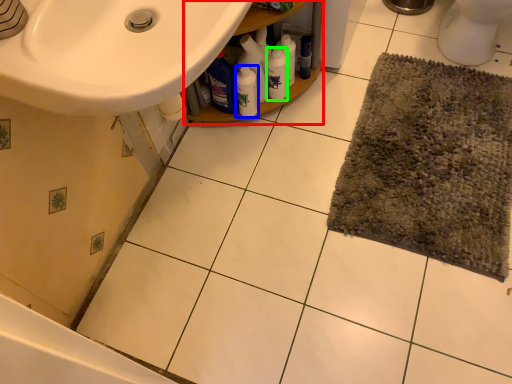
Question: Which is nearer to the balustrade (highlighted by a red box)? bottle (highlighted by a blue box) or cleaning product (highlighted by a green box).

Choices:
 (A) bottle
 (B) cleaning product

Answer: (B)